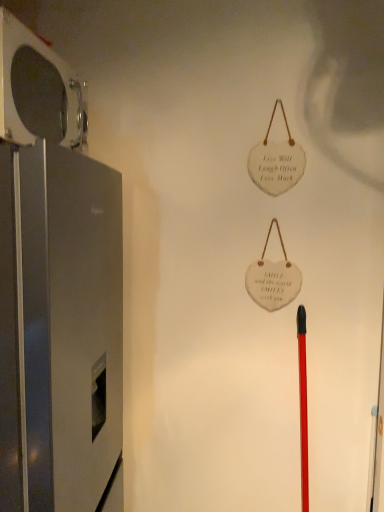
Question: Is metallic gray refrigerator at left, which appears as the 2th appliance when ordered from the bottom, situated inside satin silver refrigerator at left, the second appliance positioned from the top, or outside?

Choices:
 (A) inside
 (B) outside

Answer: (B)

Question: Based on their positions, is metallic gray refrigerator at left, which appears as the 2th appliance when ordered from the bottom, located to the left or right of satin silver refrigerator at left, the second appliance positioned from the top?

Choices:
 (A) right
 (B) left

Answer: (B)

Question: Does point (39, 101) appear closer or farther from the camera than point (29, 343)?

Choices:
 (A) farther
 (B) closer

Answer: (A)

Question: Choose the correct answer: Is satin silver refrigerator at left, the 1th appliance when ordered from bottom to top, inside metallic gray refrigerator at left, which appears as the first appliance when viewed from the top, or outside it?

Choices:
 (A) outside
 (B) inside

Answer: (A)

Question: From the image's perspective, is satin silver refrigerator at left, the second appliance positioned from the top, positioned above or below metallic gray refrigerator at left, which appears as the 2th appliance when ordered from the bottom?

Choices:
 (A) above
 (B) below

Answer: (B)

Question: Looking at their shapes, would you say satin silver refrigerator at left, the 1th appliance when ordered from bottom to top, is wider or thinner than metallic gray refrigerator at left, which appears as the first appliance when viewed from the top?

Choices:
 (A) thin
 (B) wide

Answer: (B)

Question: In terms of size, does satin silver refrigerator at left, the 1th appliance when ordered from bottom to top, appear bigger or smaller than metallic gray refrigerator at left, which appears as the first appliance when viewed from the top?

Choices:
 (A) big
 (B) small

Answer: (A)